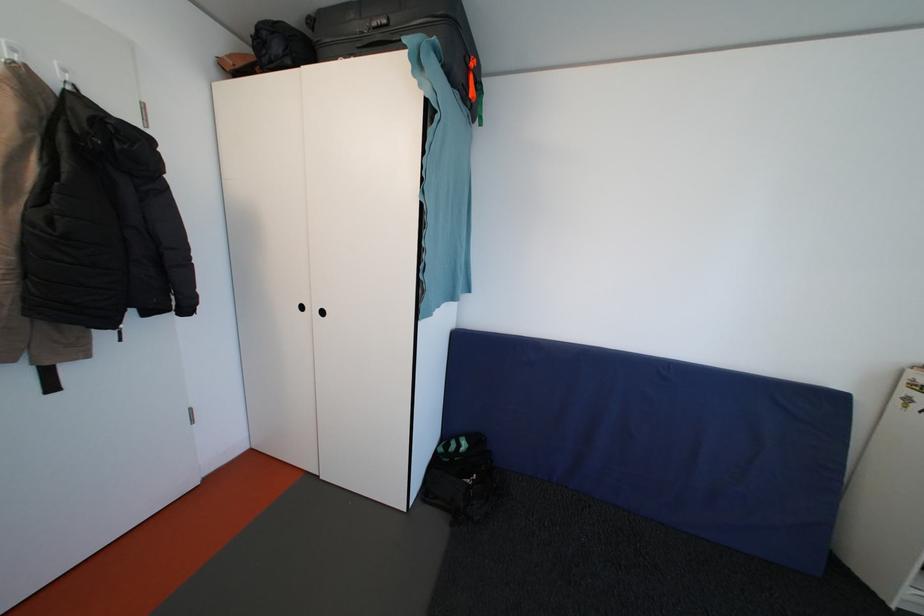
In order to click on black suitcase in this screenshot , I will do `click(402, 37)`.